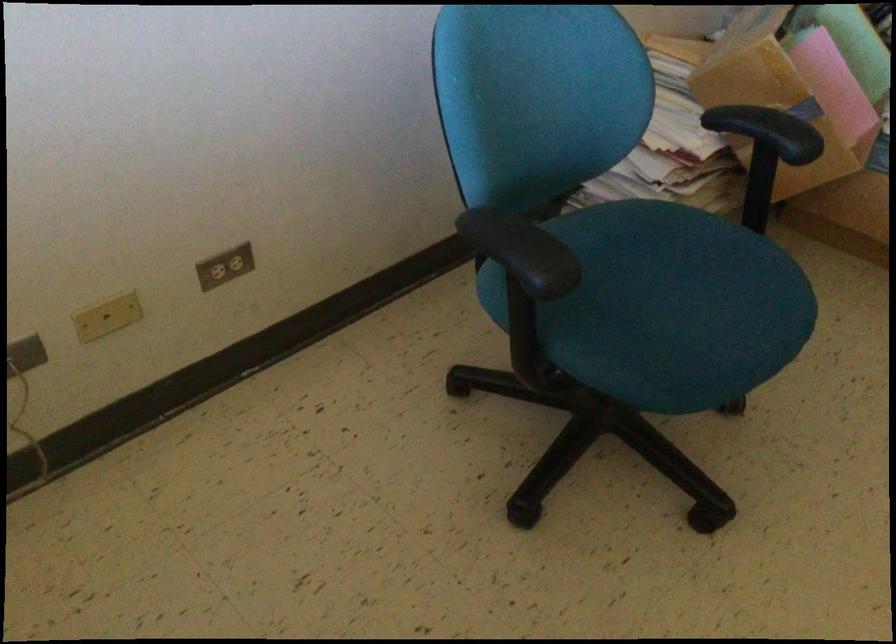
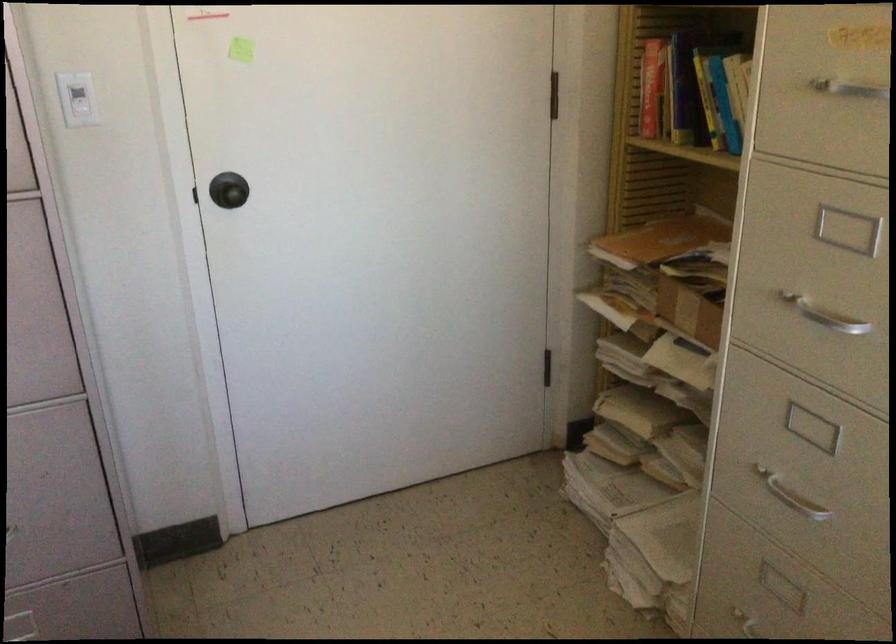
Question: The images are taken continuously from a first-person perspective. In which direction is your viewpoint rotating?

Choices:
 (A) Left
 (B) Right
 (C) Up
 (D) Down

Answer: (B)